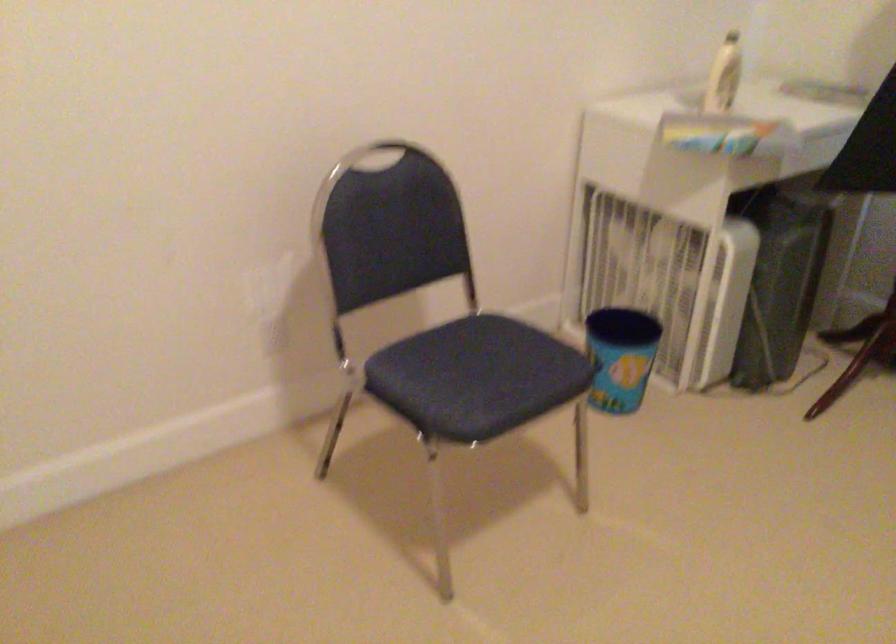
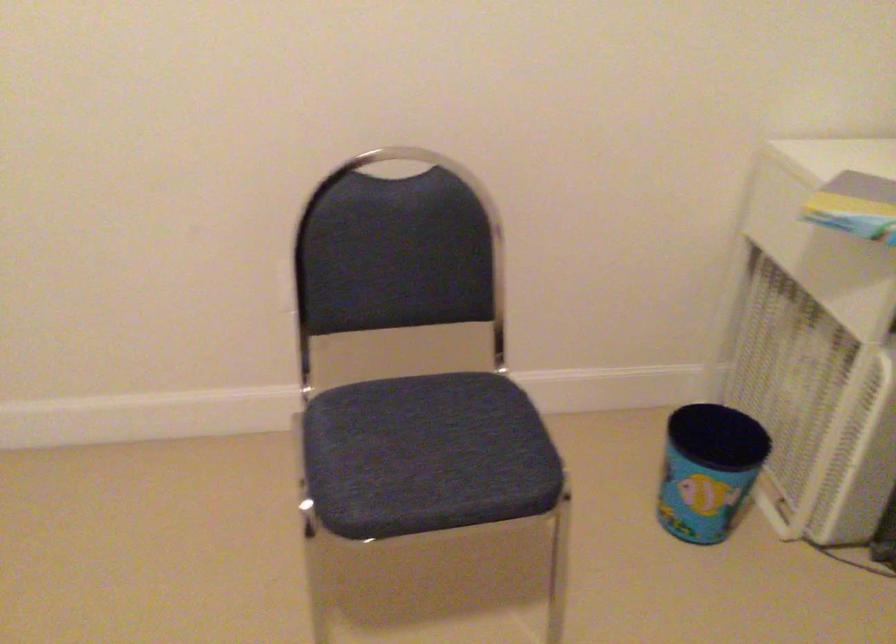
Question: The camera is either moving clockwise (left) or counter-clockwise (right) around the object. The first image is from the beginning of the video and the second image is from the end. Is the camera moving left or right when shooting the video?

Choices:
 (A) Left
 (B) Right

Answer: (B)